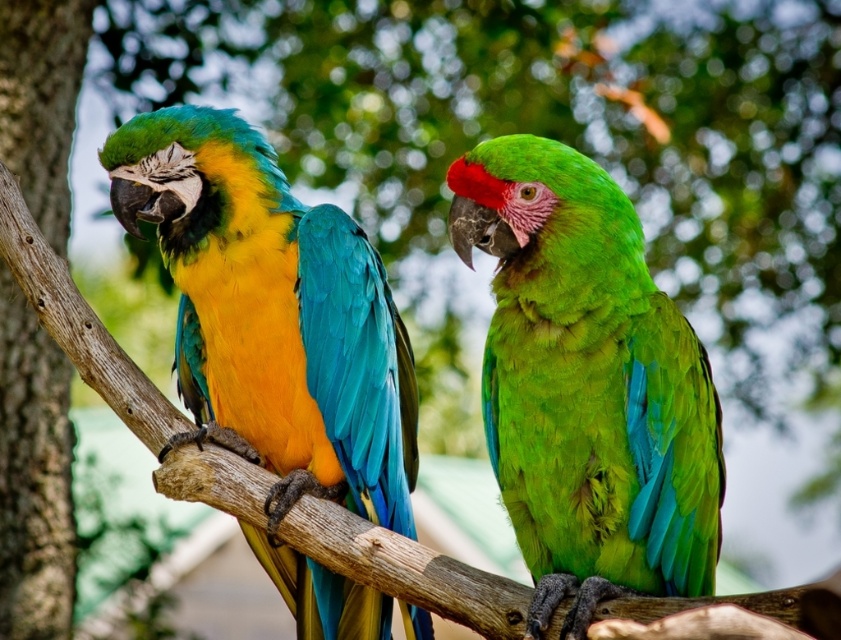
You are a birdwatcher trying to identify the parrot at the specified coordinates. Given the scene description and the objects listed, which parrot is located at point (x=586, y=385)?

The point (x=586, y=385) corresponds to the green matte parrot at center.

You are a birdwatcher observing the scene. You notice the shiny multicolored parrot at left and the rough bark tree trunk at left. Which object is wider?

The shiny multicolored parrot at left is wider than the rough bark tree trunk at left according to the description.